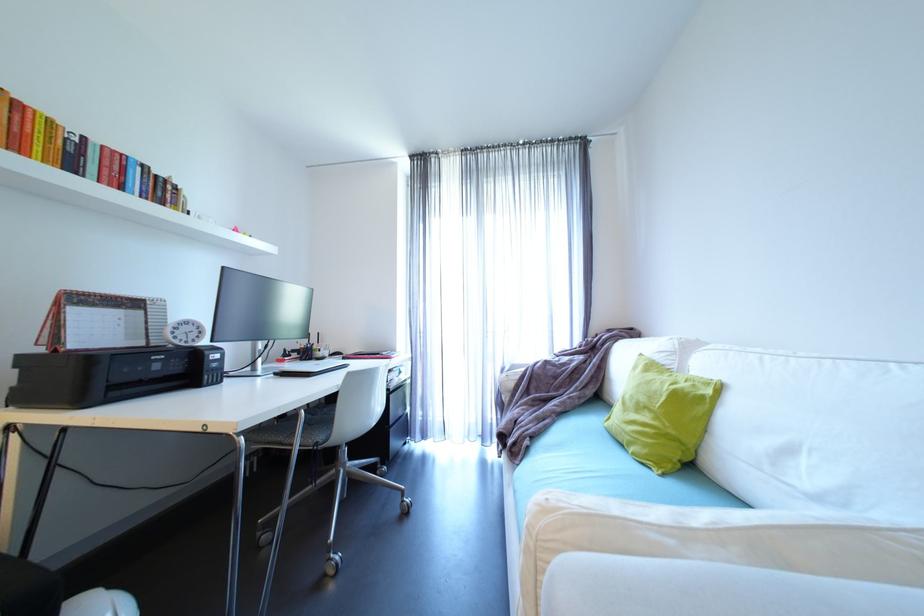
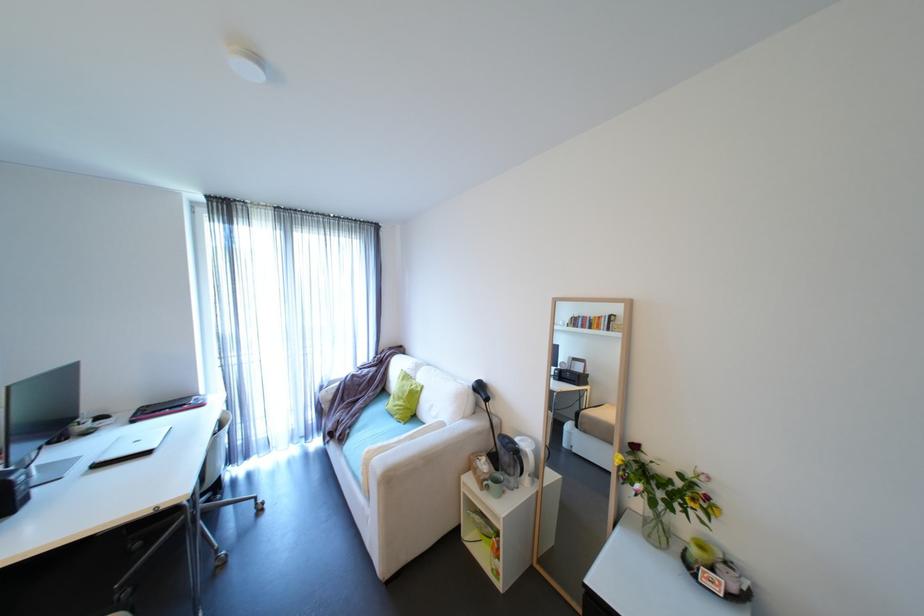
Find the pixel in the second image that matches (x=417, y=281) in the first image.

(225, 326)